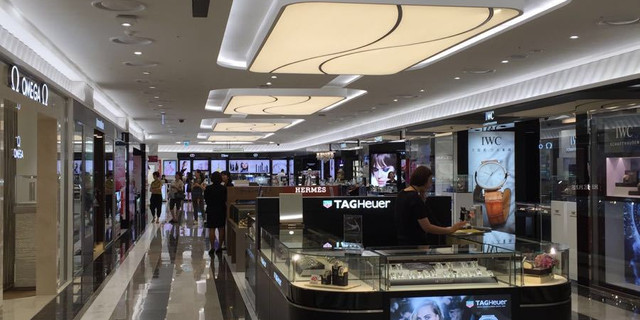
At what (x,y) coordinates should I click in order to perform the action: click on window. Please return your answer as a coordinate pair (x, y). The width and height of the screenshot is (640, 320). Looking at the image, I should click on (608, 184), (564, 179).